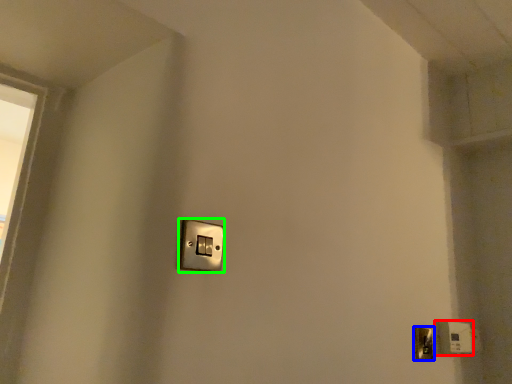
Question: Which object is the closest to the light switch (highlighted by a red box)? Choose among these: door handle (highlighted by a blue box) or light switch (highlighted by a green box).

Choices:
 (A) door handle
 (B) light switch

Answer: (A)